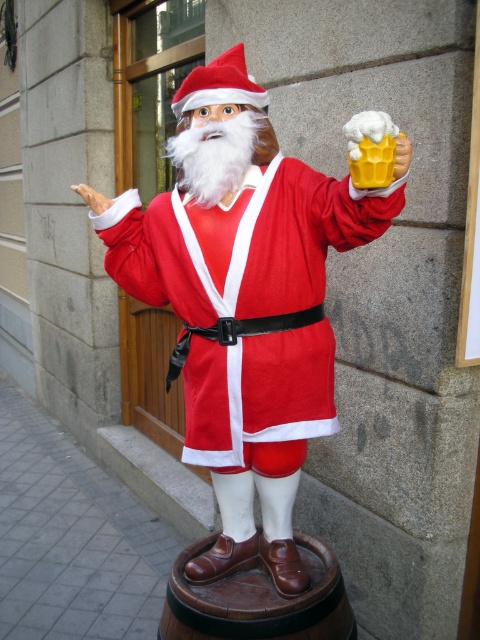
You are standing in front of the Santa statue holding the yellow matte beer mug at upper center. If you want to place the mug on the ground directly below it, where would you need to walk to in relation to the current position of the Santa statue?

The yellow matte beer mug at upper center is located at point 0.244 on the x axis and 0.838 on the y axis. To place it directly below, you would need to move it straight down along the same x coordinate to the ground level.

Based on the photo, you are a painter standing in front of the Santa statue and the hand. You want to paint both the matte red santa claus at center and the white matte hand at upper center. Which object should you paint first to avoid covering the other one?

You should paint the matte red santa claus at center first because it is in front of the white matte hand at upper center, so painting it first will prevent covering the hand behind it.

You are a photographer standing in front of the Santa Claus statue. You want to capture a closeup shot of the Santa statue holding the yellow matte beer mug at upper center. In your viewfinder, you notice the white matte hand at upper center. Which object is positioned to the right side in the frame?

The yellow matte beer mug at upper center is positioned to the right of the white matte hand at upper center in the frame.